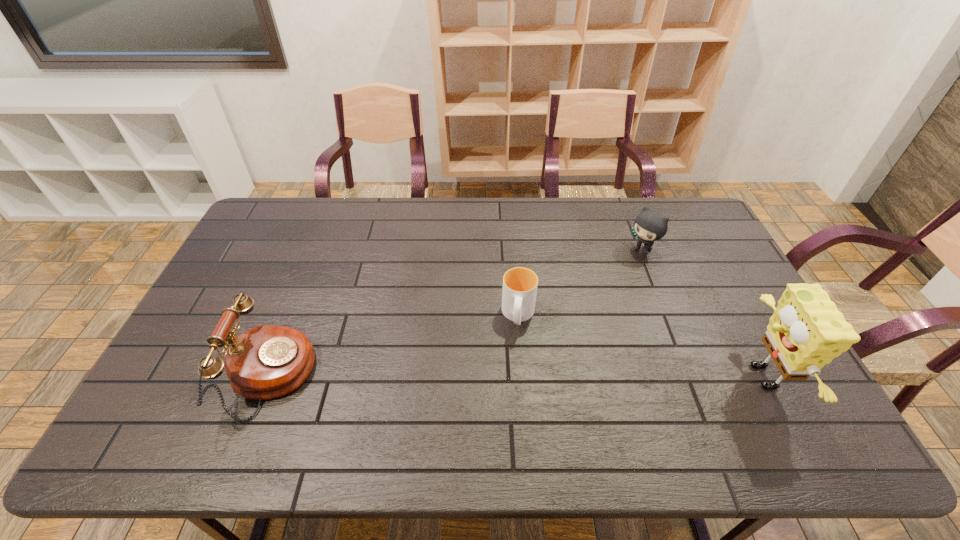
The image size is (960, 540). I want to click on vacant area between the farthest object and the leftmost object, so click(x=456, y=314).

Where is `unoccupied area between the tallest object and the leftmost object`? The width and height of the screenshot is (960, 540). unoccupied area between the tallest object and the leftmost object is located at coordinates (516, 376).

Find the location of a particular element. The height and width of the screenshot is (540, 960). empty space that is in between the leftmost object and the shortest object is located at coordinates click(395, 346).

The width and height of the screenshot is (960, 540). Identify the location of blank region between the farthest object and the third object from right to left. (580, 284).

Locate an element on the screen. This screenshot has width=960, height=540. free point between the tallest object and the kitten is located at coordinates (701, 314).

The image size is (960, 540). In order to click on vacant space that is in between the farthest object and the rightmost object in this screenshot , I will do `click(701, 314)`.

What are the coordinates of `free space between the second shortest object and the rightmost object` in the screenshot? It's located at (701, 314).

Locate which object ranks third in proximity to the cup. Please provide its 2D coordinates. Your answer should be formatted as a tuple, i.e. [(x, y)], where the tuple contains the x and y coordinates of a point satisfying the conditions above.

[(806, 331)]

Find the location of a particular element. the second closest object to the telephone is located at coordinates (649, 226).

Locate an element on the screen. The height and width of the screenshot is (540, 960). free space that satisfies the following two spatial constraints: 1. on the front side of the third object from right to left; 2. on the front-facing side of the rightmost object is located at coordinates (523, 376).